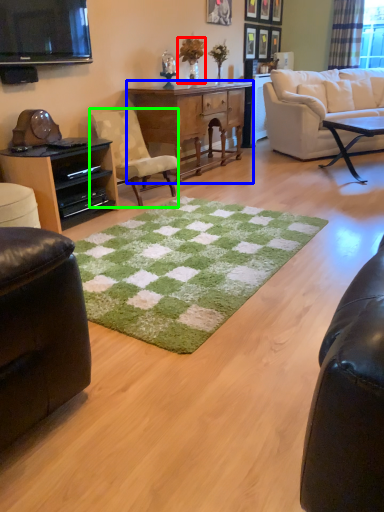
Question: Considering the real-world distances, which object is closest to houseplant (highlighted by a red box)? desk (highlighted by a blue box) or chair (highlighted by a green box).

Choices:
 (A) desk
 (B) chair

Answer: (A)